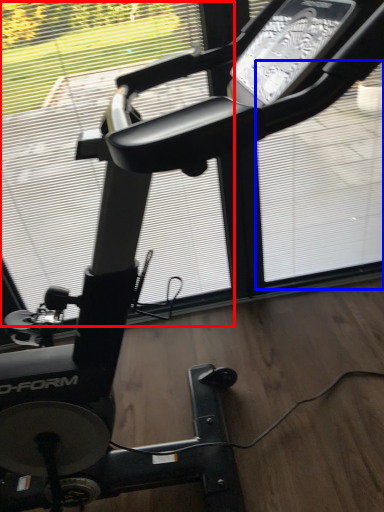
Question: Which point is closer to the camera, window screen (highlighted by a red box) or window screen (highlighted by a blue box)?

Choices:
 (A) window screen
 (B) window screen

Answer: (A)